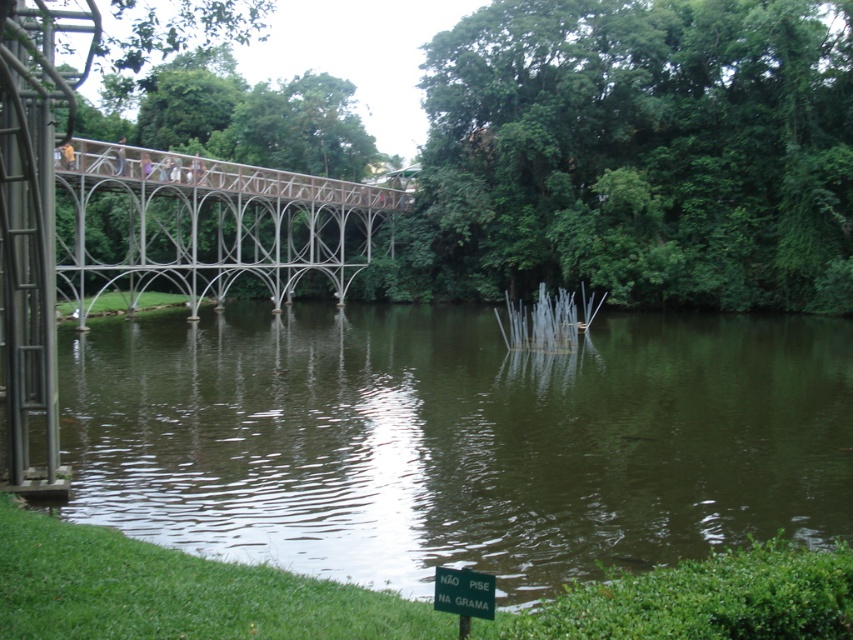
You are standing on the metal bridge and want to locate the green reflective water at center. According to the coordinates provided, where should you look relative to your position?

The green reflective water at center is located at coordinates point (457, 440), so you should look towards the lower middle area from your position on the bridge.

You are standing on the metal bridge and looking down. You see the green reflective water at center and the green plastic sign at lower center. Which object is higher from the ground?

The green reflective water at center is taller than the green plastic sign at lower center, so the green reflective water at center is higher from the ground.

You are a photographer planning to capture the green reflective water at center and the metallic bridge at upper center in a single frame. Based on their heights, which object will appear smaller in the photo?

The green reflective water at center will appear smaller in the photo because it has a lesser height compared to the metallic bridge at upper center.